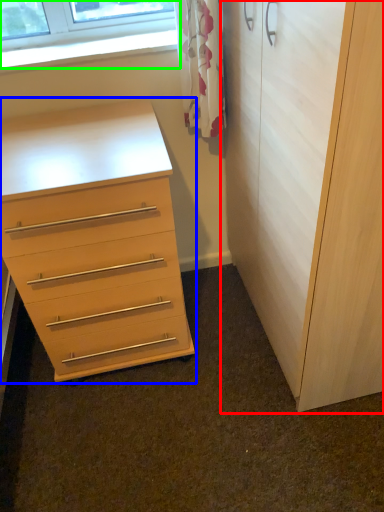
Question: Considering the real-world distances, which object is farthest from cupboard (highlighted by a red box)? chest of drawers (highlighted by a blue box) or window (highlighted by a green box)?

Choices:
 (A) chest of drawers
 (B) window

Answer: (B)